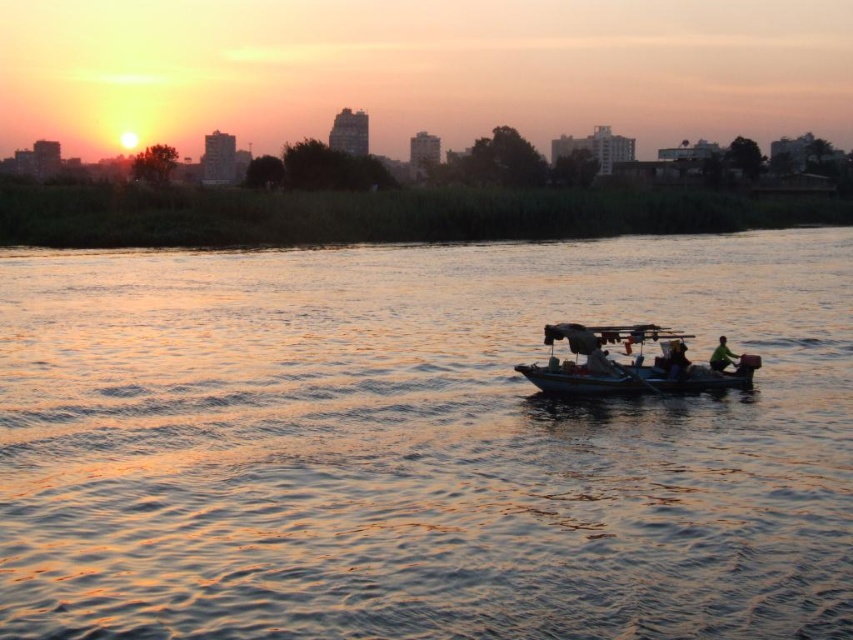
You are an observer standing on the shore looking at the golden reflective water at center and the metallic gray boat at center. Which object appears wider from your perspective?

The golden reflective water at center might be wider than the metallic gray boat at center according to the description.

You are an artist planning to paint this sunset scene. You want to emphasize the golden reflective water at center and the metallic gray boat at center. Which object should you paint first if you want to start with the larger one?

The golden reflective water at center is larger in size than the metallic gray boat at center, so you should paint the golden reflective water at center first.